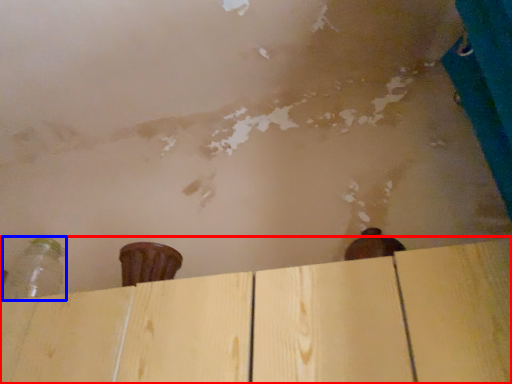
Question: Which object appears closest to the camera in this image, plywood (highlighted by a red box) or bottle (highlighted by a blue box)?

Choices:
 (A) plywood
 (B) bottle

Answer: (A)